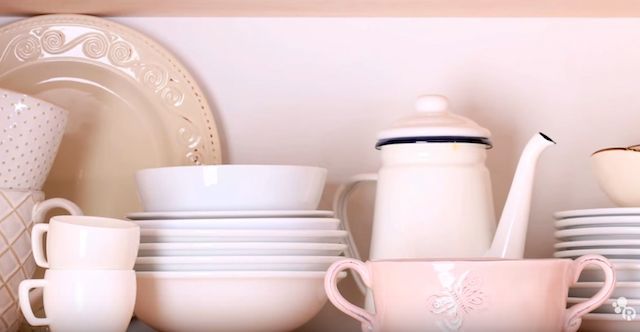
The width and height of the screenshot is (640, 332). I want to click on handles, so click(x=40, y=245), click(x=27, y=290), click(x=72, y=206), click(x=349, y=196), click(x=360, y=279), click(x=612, y=275).